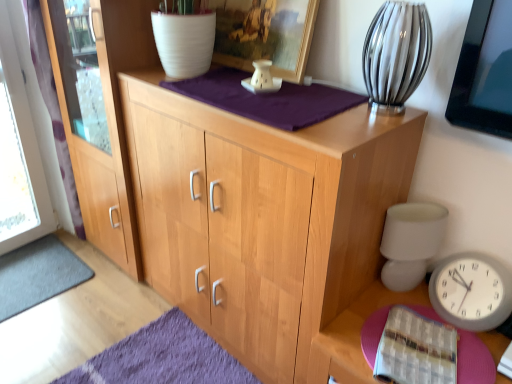
This screenshot has width=512, height=384. Describe the element at coordinates (263, 218) in the screenshot. I see `natural wood cabinet at center` at that location.

What do you see at coordinates (354, 336) in the screenshot? The height and width of the screenshot is (384, 512). I see `pink felt table at lower right` at bounding box center [354, 336].

This screenshot has height=384, width=512. What do you see at coordinates (38, 274) in the screenshot?
I see `dark gray carpet at lower left` at bounding box center [38, 274].

What do you see at coordinates (100, 111) in the screenshot? I see `matte wood screen door at left` at bounding box center [100, 111].

This screenshot has height=384, width=512. What do you see at coordinates (264, 34) in the screenshot? I see `wooden picture frame at upper center` at bounding box center [264, 34].

Locate an element on the screen. white matte table lamp at right is located at coordinates (410, 242).

Is white matte table lamp at right positioned with its back to white paper book at lower right?

No.

Between white matte table lamp at right and white paper book at lower right, which one has smaller size?

Smaller between the two is white paper book at lower right.

Considering the relative sizes of white matte table lamp at right and white paper book at lower right in the image provided, is white matte table lamp at right shorter than white paper book at lower right?

In fact, white matte table lamp at right may be taller than white paper book at lower right.

Is white paper book at lower right surrounded by white matte table lamp at right?

Actually, white paper book at lower right is outside white matte table lamp at right.

Which object is further away from the camera, natural wood cabinet at center or pink felt table at lower right?

pink felt table at lower right is further from the camera.

From the image's perspective, is natural wood cabinet at center positioned above or below pink felt table at lower right?

Clearly, from the image's perspective, natural wood cabinet at center is above pink felt table at lower right.

Is natural wood cabinet at center not inside pink felt table at lower right?

Yes, natural wood cabinet at center is not within pink felt table at lower right.

Which object is thinner, natural wood cabinet at center or pink felt table at lower right?

pink felt table at lower right.

How different are the orientations of pink felt table at lower right and white matte table lamp at right in degrees?

The angular difference between pink felt table at lower right and white matte table lamp at right is 46 degrees.

Is pink felt table at lower right bigger than white matte table lamp at right?

Actually, pink felt table at lower right might be smaller than white matte table lamp at right.

Is pink felt table at lower right facing towards white matte table lamp at right?

No, pink felt table at lower right is not aimed at white matte table lamp at right.

Considering the relative sizes of pink felt table at lower right and white matte table lamp at right in the image provided, is pink felt table at lower right wider than white matte table lamp at right?

Indeed, pink felt table at lower right has a greater width compared to white matte table lamp at right.

From a real-world perspective, is wooden picture frame at upper center positioned above or below pink felt table at lower right?

wooden picture frame at upper center is situated higher than pink felt table at lower right in the real world.

Is wooden picture frame at upper center turned away from pink felt table at lower right?

→ wooden picture frame at upper center does not have its back to pink felt table at lower right.

From the image's perspective, is wooden picture frame at upper center above or below pink felt table at lower right?

Based on their image positions, wooden picture frame at upper center is located above pink felt table at lower right.

In the scene shown: Is white paper book at lower right to the left or to the right of pink felt table at lower right in the image?

From the image, it's evident that white paper book at lower right is to the left of pink felt table at lower right.

Is white paper book at lower right not inside pink felt table at lower right?

Actually, white paper book at lower right is within pink felt table at lower right.

Is white paper book at lower right oriented away from pink felt table at lower right?

No, pink felt table at lower right is not at the back of white paper book at lower right.

Are white paper book at lower right and pink felt table at lower right beside each other?

white paper book at lower right and pink felt table at lower right are not in contact.

Considering the sizes of objects clear glass vase at upper right and pink felt table at lower right in the image provided, who is bigger, clear glass vase at upper right or pink felt table at lower right?

With larger size is clear glass vase at upper right.

Are clear glass vase at upper right and pink felt table at lower right located far from each other?

No, there isn't a large distance between clear glass vase at upper right and pink felt table at lower right.

What are the coordinates of `table located on the right of clear glass vase at upper right` in the screenshot? It's located at (354, 336).

From the image's perspective, between clear glass vase at upper right and pink felt table at lower right, who is located below?

From the image's view, pink felt table at lower right is below.

Where is `book that is on the right side of dark gray carpet at lower left`? The width and height of the screenshot is (512, 384). book that is on the right side of dark gray carpet at lower left is located at coordinates (415, 350).

Which is closer, [45,271] or [384,346]?

The point [384,346] is closer to the camera.

Based on the photo, is dark gray carpet at lower left far away from white paper book at lower right?

Yes.

Based on their positions, is dark gray carpet at lower left located to the left or right of white paper book at lower right?

dark gray carpet at lower left is positioned on white paper book at lower right's left side.

Image resolution: width=512 pixels, height=384 pixels. I want to click on table lamp behind the white paper book at lower right, so click(x=410, y=242).

What are the coordinates of `table on the right side of natural wood cabinet at center` in the screenshot? It's located at (354, 336).

Estimate the real-world distances between objects in this image. Which object is further from white paper book at lower right, pink felt table at lower right or clear glass vase at upper right?

clear glass vase at upper right lies further to white paper book at lower right than the other object.

When comparing their distances from white matte table lamp at right, does white paper book at lower right or natural wood cabinet at center seem further?

Based on the image, natural wood cabinet at center appears to be further to white matte table lamp at right.

Looking at the image, which one is located closer to natural wood cabinet at center, clear glass vase at upper right or dark gray carpet at lower left?

clear glass vase at upper right is positioned closer to the anchor natural wood cabinet at center.

From the image, which object appears to be farther from white matte table lamp at right, matte wood screen door at left or dark gray carpet at lower left?

The object further to white matte table lamp at right is dark gray carpet at lower left.

Based on the photo, based on their spatial positions, is clear glass vase at upper right or dark gray carpet at lower left closer to white matte table lamp at right?

Among the two, clear glass vase at upper right is located nearer to white matte table lamp at right.

Which object lies nearer to the anchor point pink felt table at lower right, wooden picture frame at upper center or clear glass vase at upper right?

clear glass vase at upper right is positioned closer to the anchor pink felt table at lower right.

Estimate the real-world distances between objects in this image. Which object is closer to natural wood cabinet at center, wooden picture frame at upper center or matte wood screen door at left?

wooden picture frame at upper center lies closer to natural wood cabinet at center than the other object.

Estimate the real-world distances between objects in this image. Which object is further from matte wood screen door at left, white matte table lamp at right or white paper book at lower right?

Among the two, white paper book at lower right is located further to matte wood screen door at left.

Where is `screen door between dark gray carpet at lower left and pink felt table at lower right in the horizontal direction`? Image resolution: width=512 pixels, height=384 pixels. screen door between dark gray carpet at lower left and pink felt table at lower right in the horizontal direction is located at coordinates pyautogui.click(x=100, y=111).

You are a GUI agent. You are given a task and a screenshot of the screen. Output one action in this format:
    pyautogui.click(x=<x>, y=<y>)
    Task: Click on the picture frame between matte wood screen door at left and clear glass vase at upper right from left to right
    Image resolution: width=512 pixels, height=384 pixels.
    Given the screenshot: What is the action you would take?
    pyautogui.click(x=264, y=34)

I want to click on cabinetry located between dark gray carpet at lower left and white paper book at lower right in the left-right direction, so click(x=263, y=218).

Identify the location of book located between dark gray carpet at lower left and white matte table lamp at right in the left-right direction. The image size is (512, 384). (415, 350).